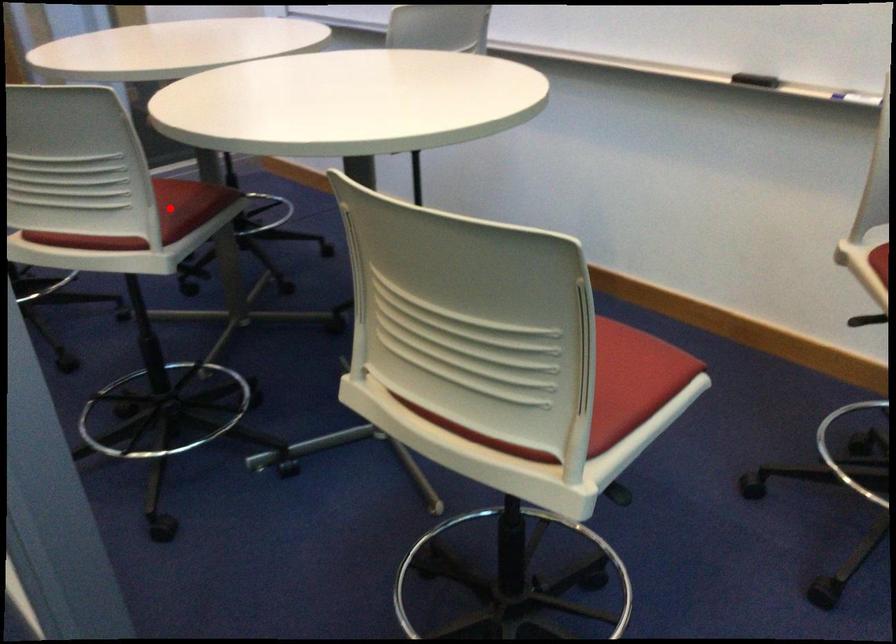
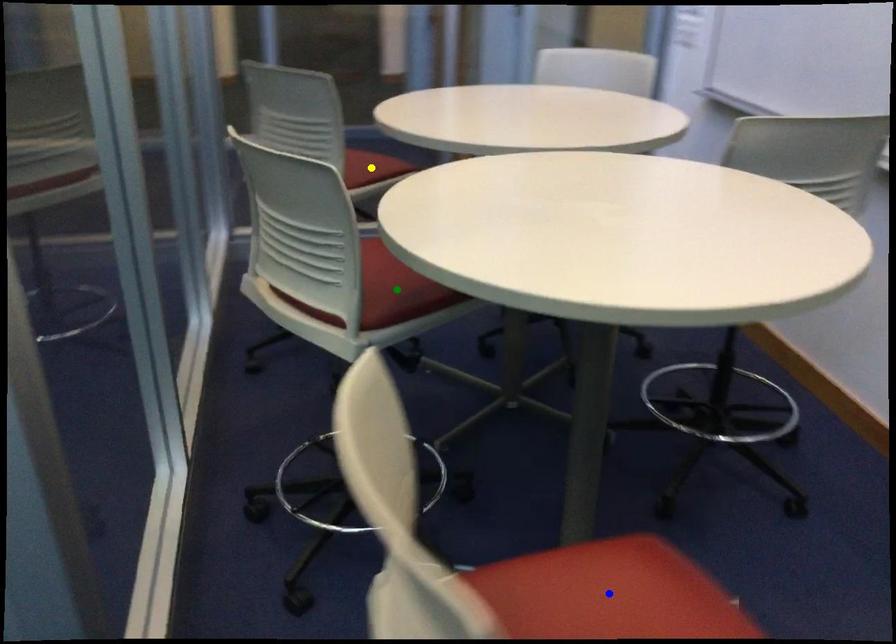
Question: I am providing you with two images of the same scene from different viewpoints. A red point is marked on the first image. You are given multiple points on the second image. Can you choose the point in image 2 that corresponds to the point in image 1?

Choices:
 (A) yellow point
 (B) blue point
 (C) green point

Answer: (C)